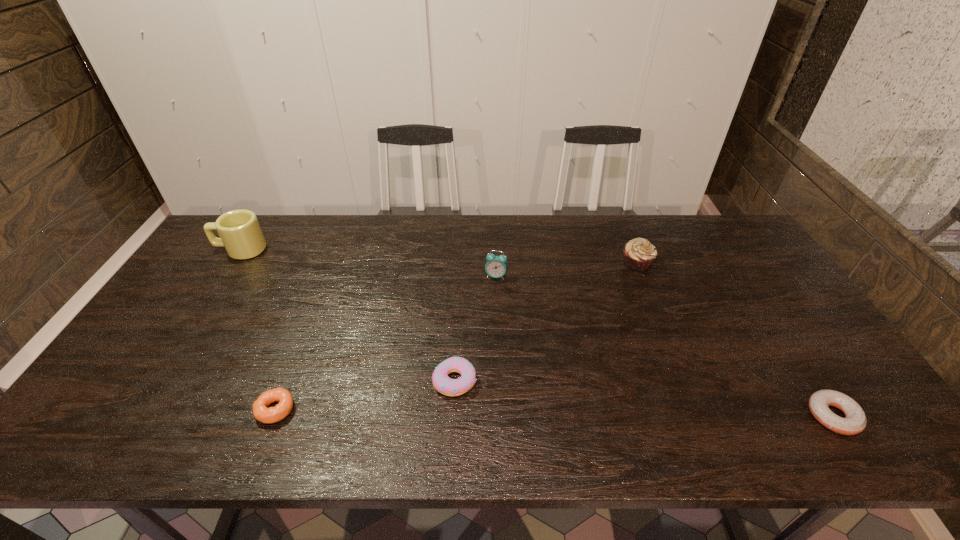
The width and height of the screenshot is (960, 540). Identify the location of vacant space located on the left of the rightmost object. (770, 416).

The height and width of the screenshot is (540, 960). Identify the location of vacant region located 0.270m on the right of the leftmost doughnut. (409, 409).

You are a GUI agent. You are given a task and a screenshot of the screen. Output one action in this format:
    pyautogui.click(x=<x>, y=<y>)
    Task: Click on the mug that is positioned at the far edge
    
    Given the screenshot: What is the action you would take?
    (240, 233)

Identify the location of muffin that is positioned at the far edge. (639, 254).

Locate an element on the screen. object positioned at the left edge is located at coordinates (240, 233).

This screenshot has height=540, width=960. I want to click on object at the right edge, so click(x=855, y=420).

Find the location of `object at the far left corner`. object at the far left corner is located at coordinates (240, 233).

Where is `object at the near right corner`? Image resolution: width=960 pixels, height=540 pixels. object at the near right corner is located at coordinates (855, 420).

Locate an element on the screen. vacant region at the far edge of the desktop is located at coordinates (560, 215).

This screenshot has width=960, height=540. In order to click on vacant area at the near edge of the desktop in this screenshot , I will do `click(210, 438)`.